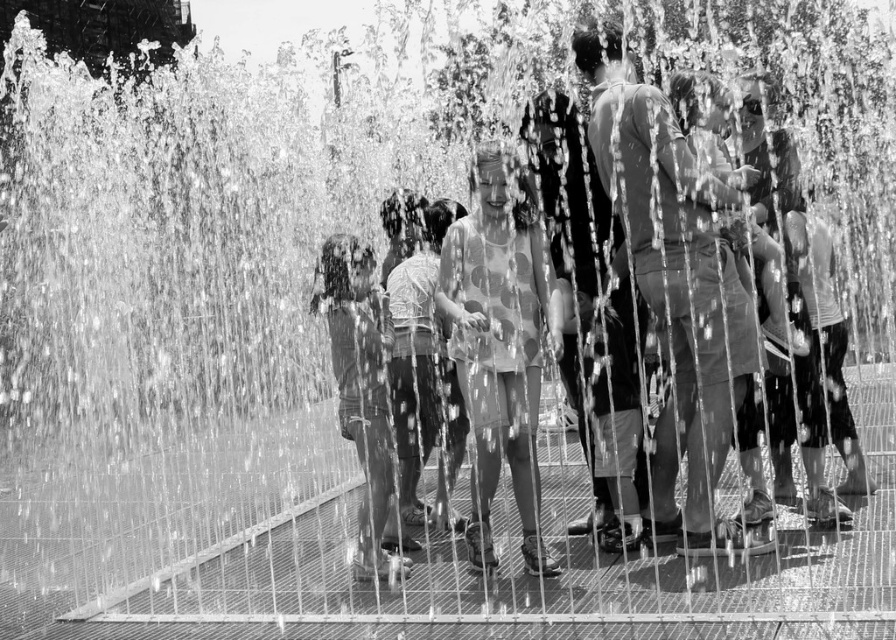
You are a photographer trying to capture the perfect shot of the two people at the fountain. You notice the matte gray shorts at center and the smooth fabric shirt at center. Which clothing item is positioned to the right of the other?

The matte gray shorts at center are to the right of the smooth fabric shirt at center.

You are a photographer trying to capture a clear shot of the smooth fabric shirt at center without the matte gray shorts at center blocking it. Based on the scene, can you adjust your angle to achieve this?

The matte gray shorts at center is positioned over smooth fabric shirt at center, so adjusting your angle downward might allow you to capture the smooth fabric shirt at center without obstruction.